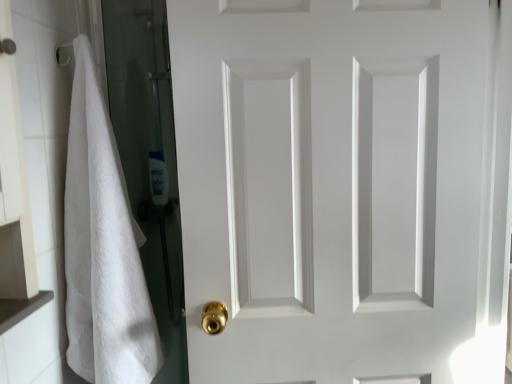
Question: Does white matte door at center come behind white fluffy towel at left?

Choices:
 (A) no
 (B) yes

Answer: (B)

Question: Is white matte door at center located outside white fluffy towel at left?

Choices:
 (A) yes
 (B) no

Answer: (A)

Question: Is white matte door at center not near white fluffy towel at left?

Choices:
 (A) yes
 (B) no

Answer: (B)

Question: From the image's perspective, would you say white matte door at center is positioned over white fluffy towel at left?

Choices:
 (A) yes
 (B) no

Answer: (A)

Question: Can you confirm if white matte door at center is wider than white fluffy towel at left?

Choices:
 (A) yes
 (B) no

Answer: (B)

Question: Is white matte door at center at the right side of white fluffy towel at left?

Choices:
 (A) no
 (B) yes

Answer: (B)

Question: Considering the relative sizes of white fluffy towel at left and white matte door at center in the image provided, is white fluffy towel at left shorter than white matte door at center?

Choices:
 (A) no
 (B) yes

Answer: (B)

Question: From a real-world perspective, is white fluffy towel at left over white matte door at center?

Choices:
 (A) yes
 (B) no

Answer: (B)

Question: Is white fluffy towel at left wider than white matte door at center?

Choices:
 (A) no
 (B) yes

Answer: (B)

Question: Can white matte door at center be found inside white fluffy towel at left?

Choices:
 (A) yes
 (B) no

Answer: (B)

Question: Can you confirm if white fluffy towel at left is positioned to the left of white matte door at center?

Choices:
 (A) yes
 (B) no

Answer: (A)

Question: Is white fluffy towel at left smaller than white matte door at center?

Choices:
 (A) no
 (B) yes

Answer: (B)

Question: In terms of width, does white fluffy towel at left look wider or thinner when compared to white matte door at center?

Choices:
 (A) wide
 (B) thin

Answer: (A)